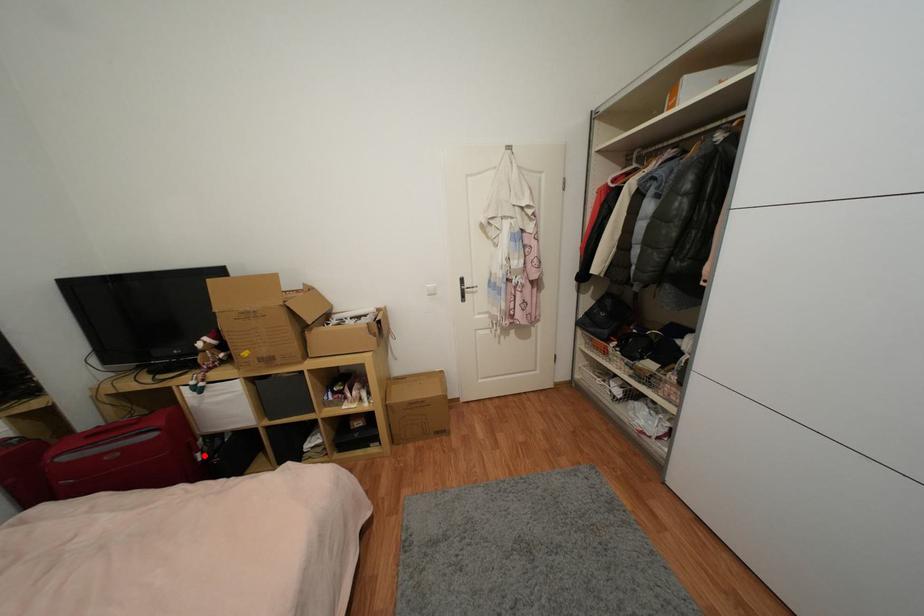
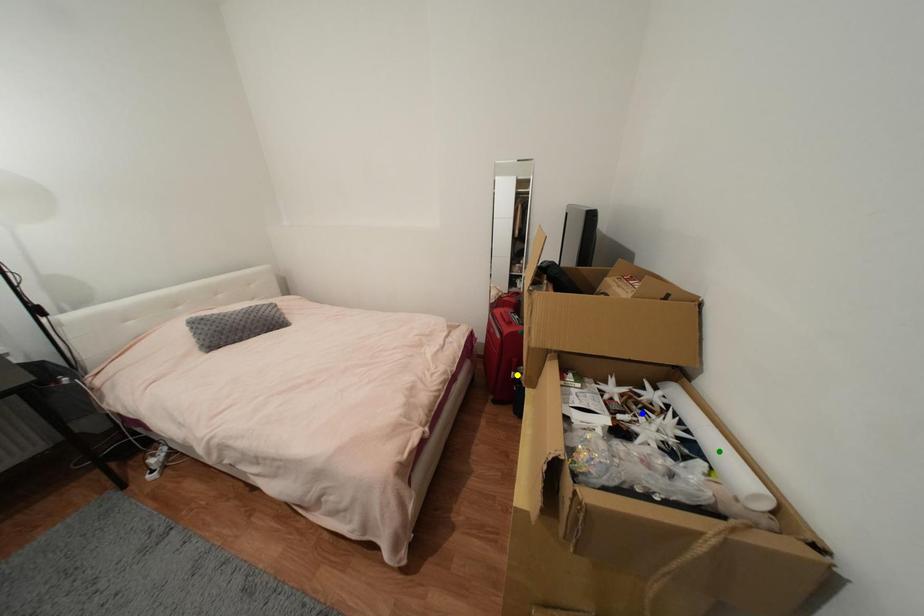
Question: I am providing you with two images of the same scene from different viewpoints. A red point is marked on the first image. You are given multiple points on the second image. Which point in image 2 represents the same 3d spot as the red point in image 1?

Choices:
 (A) yellow point
 (B) green point
 (C) blue point

Answer: (A)